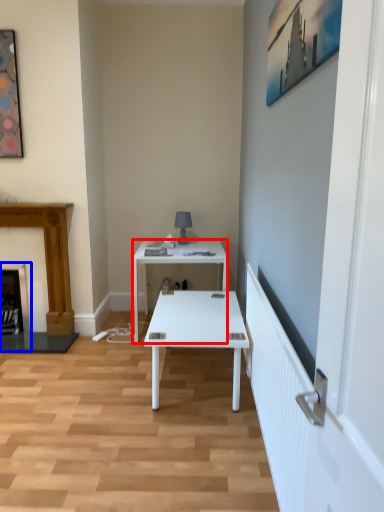
Question: Which object is closer to the camera taking this photo, desk (highlighted by a red box) or fireplace (highlighted by a blue box)?

Choices:
 (A) desk
 (B) fireplace

Answer: (A)